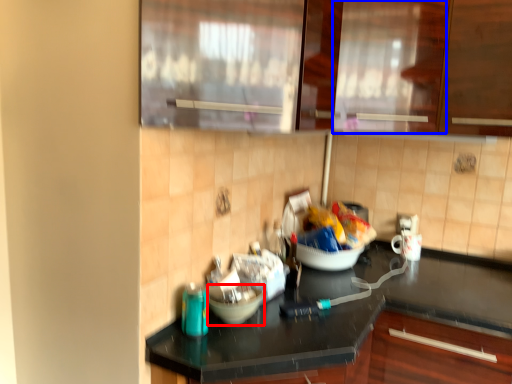
Question: Which object is further to the camera taking this photo, mixing bowl (highlighted by a red box) or glass door (highlighted by a blue box)?

Choices:
 (A) mixing bowl
 (B) glass door

Answer: (B)